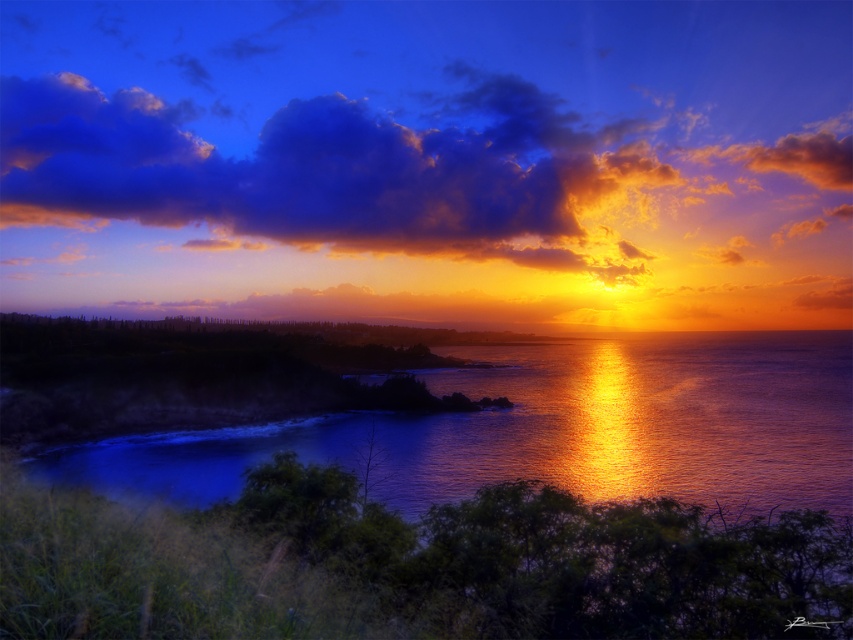
You are a photographer who wants to capture the sunset scene. You notice the cloudy sky at upper center and the shiny reflective water at center. Which object would be closer to the camera in your photo?

The cloudy sky at upper center is closer to the camera because it is in front of the shiny reflective water at center.

You are a photographer trying to capture the sunset. You want to ensure that both the cloudy sky at upper center and the shiny reflective water at center are visible in your shot. Which object should you focus on to include both in the frame?

The cloudy sky at upper center has a greater height compared to the shiny reflective water at center. To include both in the frame, focus on the cloudy sky at upper center as it occupies more vertical space.

You are analyzing the composition of the sunset image. The cloudy sky at upper center is positioned at coordinates point 0.273, 0.436. What does this coordinate indicate about its placement in the scene?

The cloudy sky at upper center is located at point (370, 173), which means it is positioned approximately 27.3 percent from the left edge and 43.6 percent from the bottom edge of the image.